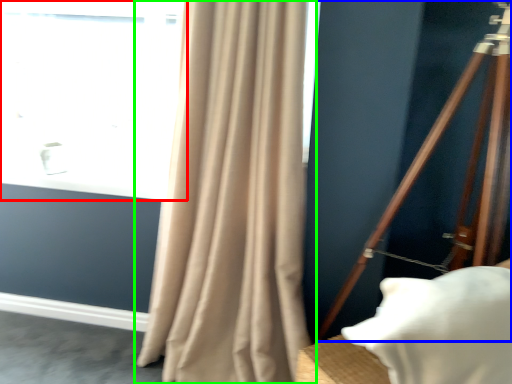
Question: Which object is positioned closest to window (highlighted by a red box)? Select from tripod (highlighted by a blue box) and curtain (highlighted by a green box).

Choices:
 (A) tripod
 (B) curtain

Answer: (B)